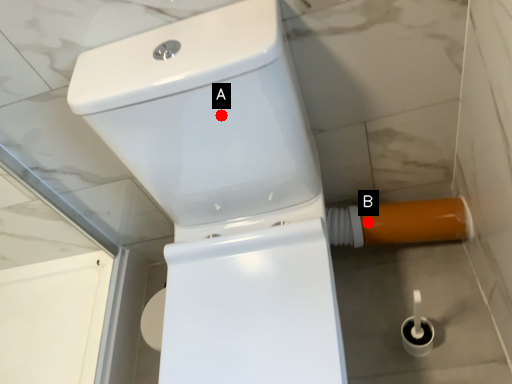
Question: Two points are circled on the image, labeled by A and B beside each circle. Which point is closer to the camera?

Choices:
 (A) A is closer
 (B) B is closer

Answer: (A)